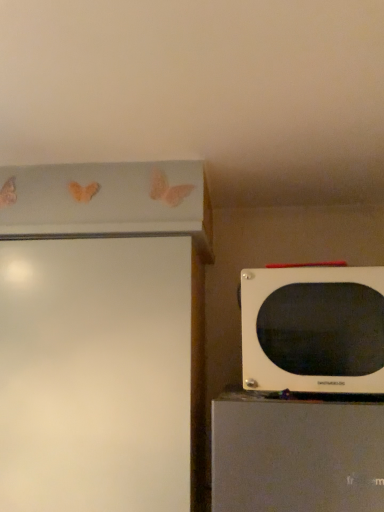
Question: Is point (299, 318) positioned closer to the camera than point (127, 376)?

Choices:
 (A) farther
 (B) closer

Answer: (B)

Question: Is white matte microwave at right taller or shorter than white glossy screen door at left?

Choices:
 (A) tall
 (B) short

Answer: (B)

Question: Looking at the image, does white matte microwave at right seem bigger or smaller compared to white glossy screen door at left?

Choices:
 (A) small
 (B) big

Answer: (A)

Question: In terms of height, does white glossy screen door at left look taller or shorter compared to white matte microwave at right?

Choices:
 (A) short
 (B) tall

Answer: (B)

Question: Considering the positions of white glossy screen door at left and white matte microwave at right in the image, is white glossy screen door at left wider or thinner than white matte microwave at right?

Choices:
 (A) wide
 (B) thin

Answer: (A)

Question: From the image's perspective, is white glossy screen door at left above or below white matte microwave at right?

Choices:
 (A) above
 (B) below

Answer: (B)

Question: Is white glossy screen door at left in front of or behind white matte microwave at right in the image?

Choices:
 (A) behind
 (B) front

Answer: (A)